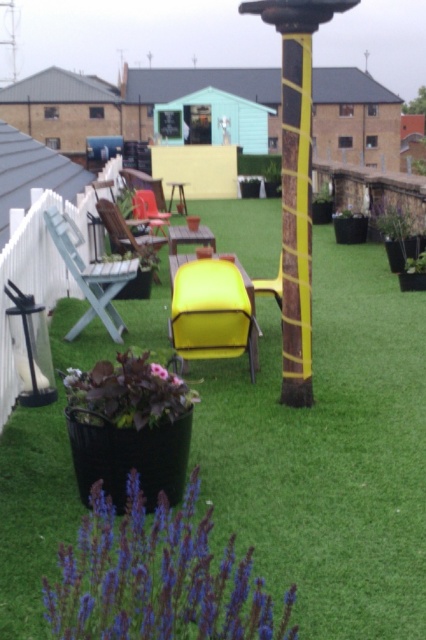
You are a delivery person carrying a large box that measures 3 meters in length. You need to navigate through the space between the yellow painted metal pole at center and the light gray plastic chair at left. Can you fit through the space without tilting the box?

The distance between the yellow painted metal pole at center and the light gray plastic chair at left is 2.60 meters. Since the box is 3 meters long, it is longer than the available space. Therefore, you cannot fit through the space without tilting the box.

You are planning to place a small side table between the matte red chair at center and the yellow plastic chair at center. Considering their widths, which chair might require more space on either side to accommodate the table?

The matte red chair at center has a larger width than the yellow plastic chair at center, so it would require more space on either side to accommodate the table.

You are standing on the patio and want to place a small potted plant between the yellow painted metal pole at center and the matte red chair at center. Which object should you place the plant closer to if you want it to appear larger in your photo?

To make the potted plant appear larger in your photo, place it closer to the yellow painted metal pole at center since it is closer to the viewer than the matte red chair at center, making objects near it appear bigger due to perspective.